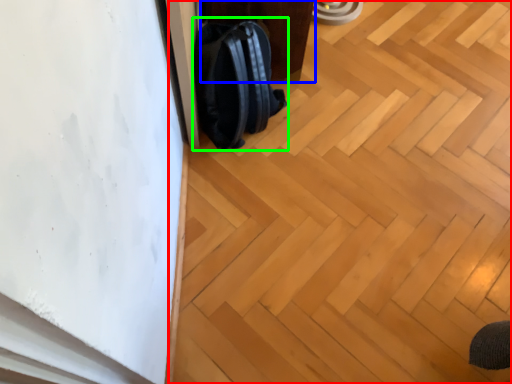
Question: Considering the real-world distances, which object is closest to plywood (highlighted by a red box)? furniture (highlighted by a blue box) or backpack (highlighted by a green box).

Choices:
 (A) furniture
 (B) backpack

Answer: (B)